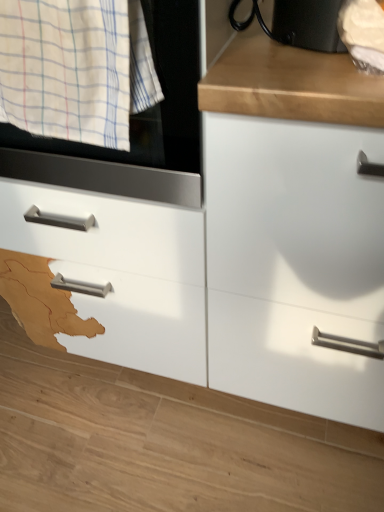
The image size is (384, 512). What do you see at coordinates (75, 68) in the screenshot?
I see `white checkered cloth at left` at bounding box center [75, 68].

Identify the location of white checkered cloth at left. (75, 68).

Measure the distance between point [46,4] and camera.

54.40 centimeters.

Where is `white checkered cloth at left`? The width and height of the screenshot is (384, 512). white checkered cloth at left is located at coordinates (75, 68).